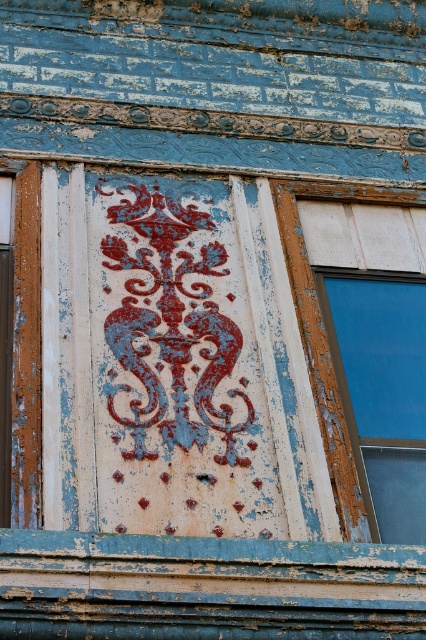
Is rusty metal octopus at center positioned at the back of blue glass window at right?

Yes, it is.

Locate an element on the screen. The height and width of the screenshot is (640, 426). rusty metal octopus at center is located at coordinates (170, 326).